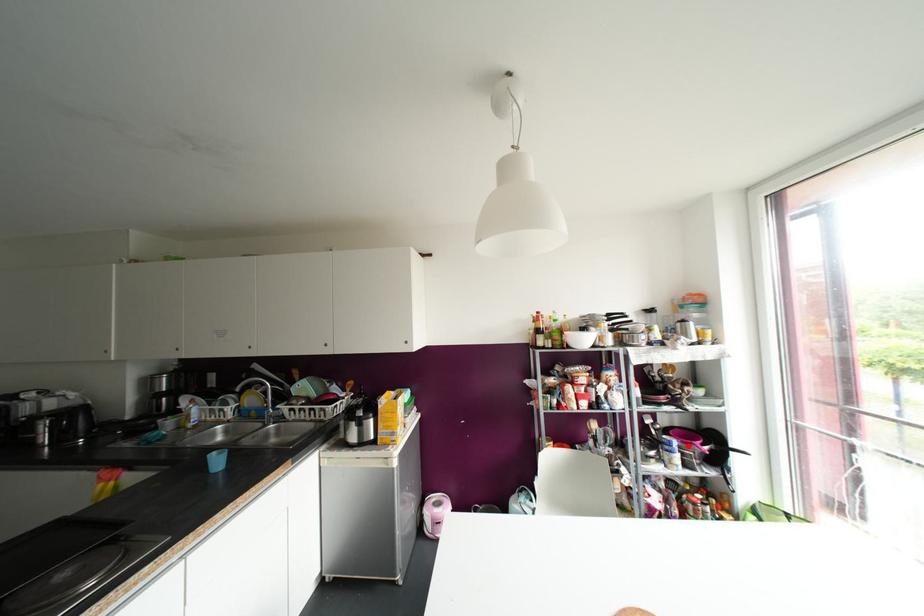
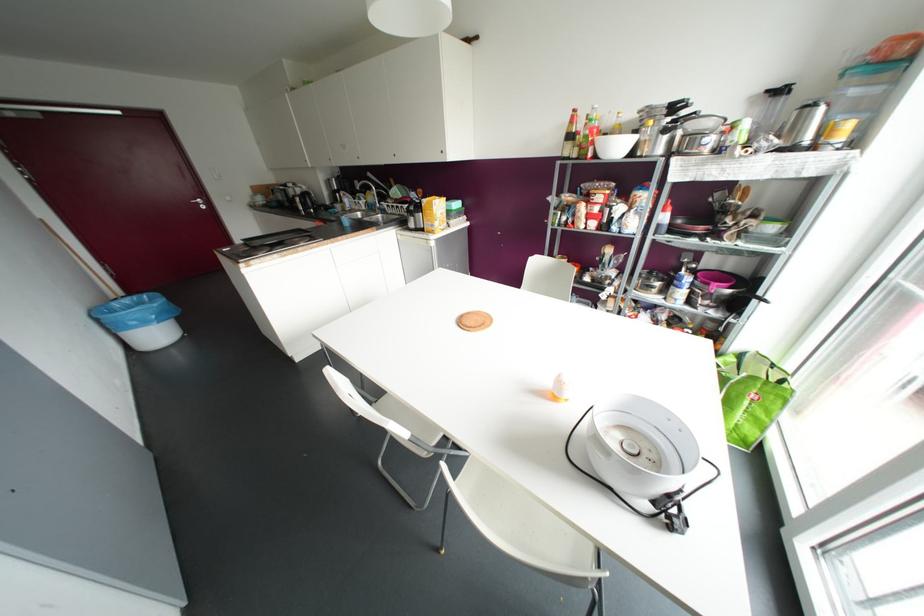
Locate, in the second image, the point that corresponds to the highlighted location in the first image.

(703, 286)